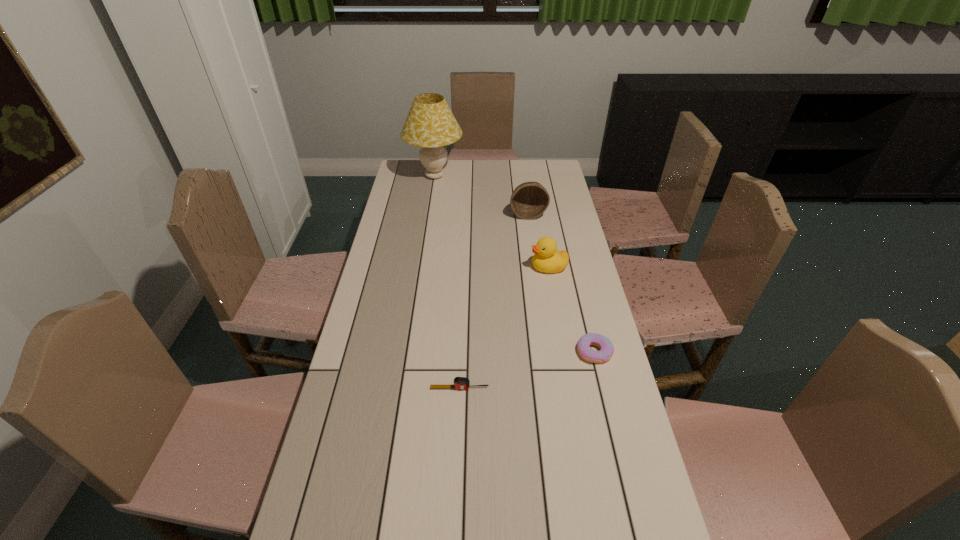
Find the location of a particular element. This screenshot has width=960, height=540. free space that is in between the second farthest object and the third farthest object is located at coordinates (539, 241).

At what (x,y) coordinates should I click in order to perform the action: click on free space between the second farthest object and the nearest object. Please return your answer as a coordinate pair (x, y). Looking at the image, I should click on (493, 301).

Where is `vacant area that lies between the tape measure and the third farthest object`? vacant area that lies between the tape measure and the third farthest object is located at coordinates (504, 328).

Identify the location of vacant region between the second tallest object and the second nearest object. This screenshot has height=540, width=960. (562, 283).

Find the location of a particular element. The image size is (960, 540). object that stands as the third closest to the duck is located at coordinates (460, 383).

Select which object is the closest to the nearest object. Please provide its 2D coordinates. Your answer should be formatted as a tuple, i.e. [(x, y)], where the tuple contains the x and y coordinates of a point satisfying the conditions above.

[(606, 347)]

Find the location of a particular element. The width and height of the screenshot is (960, 540). vacant point that satisfies the following two spatial constraints: 1. at the beak of the doughnut; 2. on the right side of the third farthest object is located at coordinates (564, 352).

This screenshot has width=960, height=540. What are the coordinates of `vacant area that satisfies the following two spatial constraints: 1. at the beak of the second nearest object; 2. on the right side of the duck` in the screenshot? It's located at (564, 352).